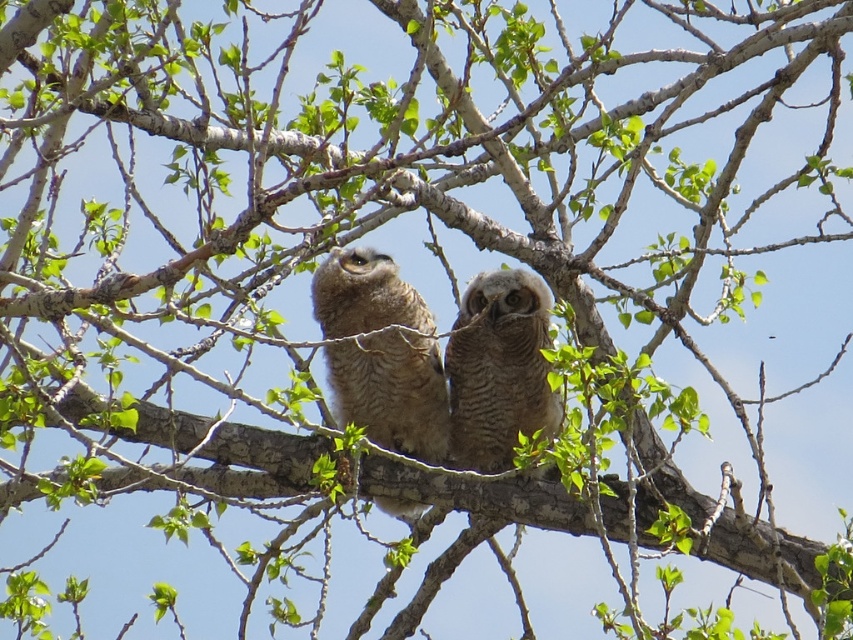
Question: Is brown speckled owl at center thinner than brown textured owl at center?

Choices:
 (A) no
 (B) yes

Answer: (A)

Question: Is brown speckled owl at center wider than brown textured owl at center?

Choices:
 (A) yes
 (B) no

Answer: (A)

Question: Which point appears closest to the camera in this image?

Choices:
 (A) (520, 316)
 (B) (312, 282)

Answer: (A)

Question: Which point appears closest to the camera in this image?

Choices:
 (A) (466, 410)
 (B) (335, 358)

Answer: (B)

Question: Among these points, which one is nearest to the camera?

Choices:
 (A) (334, 323)
 (B) (508, 269)

Answer: (B)

Question: Is brown speckled owl at center positioned before brown textured owl at center?

Choices:
 (A) yes
 (B) no

Answer: (A)